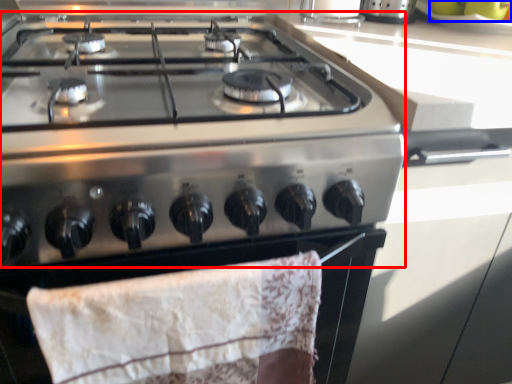
Question: Which point is further to the camera, gas stove (highlighted by a red box) or fruit (highlighted by a blue box)?

Choices:
 (A) gas stove
 (B) fruit

Answer: (B)